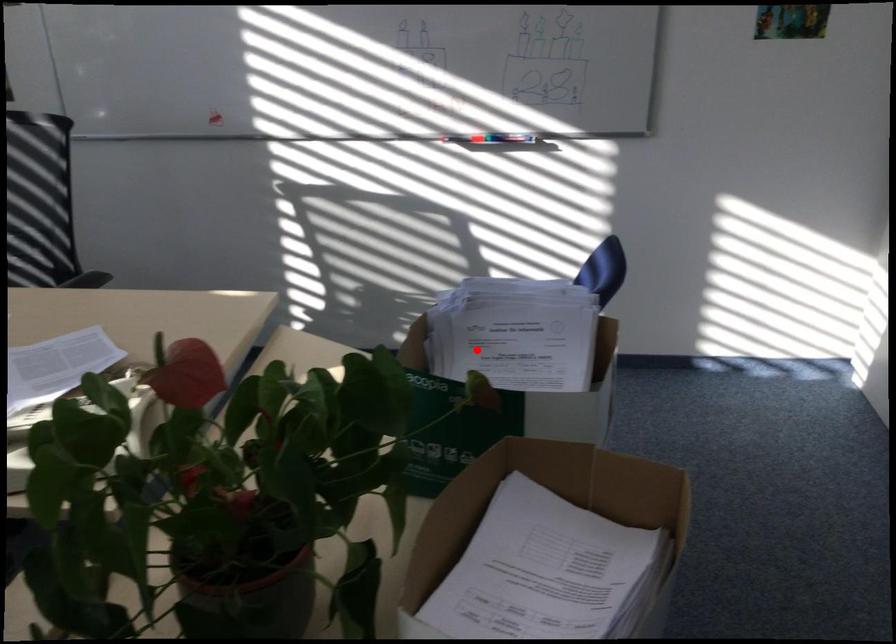
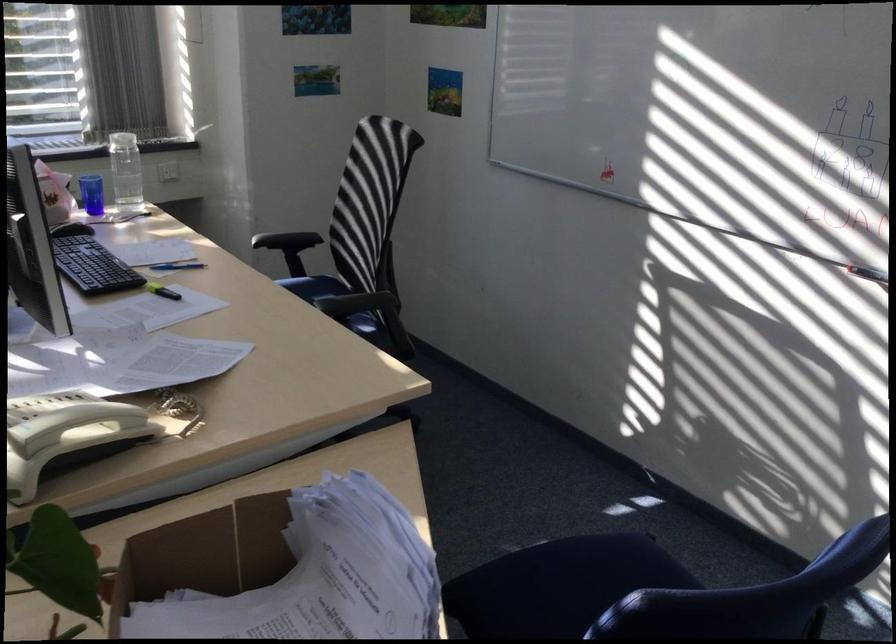
Question: I am providing you with two images of the same scene from different viewpoints. Given a red point in image1, look at the same physical point in image2. Is it:

Choices:
 (A) Closer to the viewpoint
 (B) Farther from the viewpoint

Answer: (A)